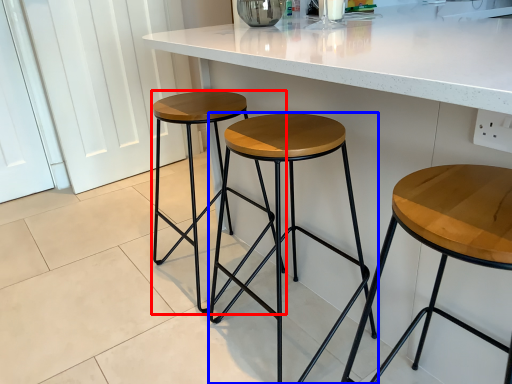
Question: Which object appears closest to the camera in this image, stool (highlighted by a red box) or stool (highlighted by a blue box)?

Choices:
 (A) stool
 (B) stool

Answer: (B)